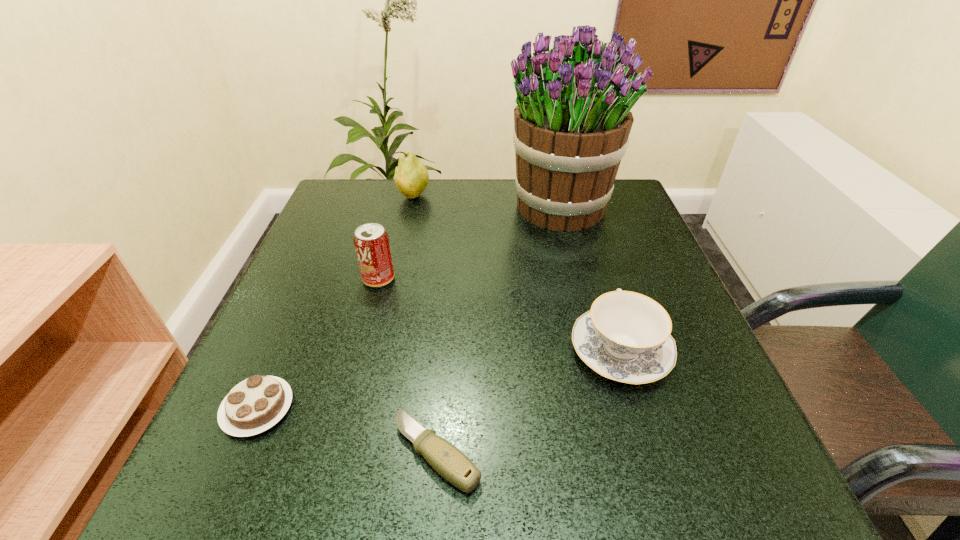
Locate an element on the screen. bouquet that is at the right edge is located at coordinates (572, 121).

Where is `chinaware that is positioned at the right edge`? chinaware that is positioned at the right edge is located at coordinates (625, 337).

Image resolution: width=960 pixels, height=540 pixels. What are the coordinates of `object that is at the far right corner` in the screenshot? It's located at tap(572, 121).

Where is `vacant area at the far edge of the desktop`? vacant area at the far edge of the desktop is located at coordinates (478, 180).

In the image, there is a desktop. Where is `vacant space at the near edge`? This screenshot has height=540, width=960. vacant space at the near edge is located at coordinates (492, 480).

You are a GUI agent. You are given a task and a screenshot of the screen. Output one action in this format:
    pyautogui.click(x=<x>, y=<y>)
    Task: Click on the free location at the left edge of the desktop
    The image size is (960, 540).
    Given the screenshot: What is the action you would take?
    pyautogui.click(x=343, y=307)

The image size is (960, 540). In the image, there is a desktop. In order to click on vacant space at the right edge in this screenshot , I will do `click(637, 388)`.

I want to click on vacant area at the far left corner of the desktop, so click(x=343, y=194).

Locate an element on the screen. The width and height of the screenshot is (960, 540). vacant space that is in between the chocolate cake and the bouquet is located at coordinates (409, 308).

You are a GUI agent. You are given a task and a screenshot of the screen. Output one action in this format:
    pyautogui.click(x=<x>, y=<y>)
    Task: Click on the free area in between the tallest object and the fourth tallest object
    The height and width of the screenshot is (540, 960).
    Given the screenshot: What is the action you would take?
    pyautogui.click(x=590, y=279)